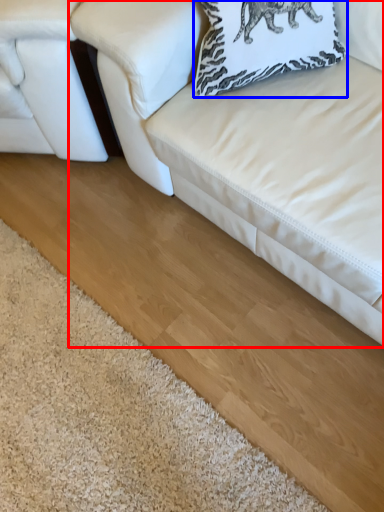
Question: Which of the following is the closest to the observer, studio couch (highlighted by a red box) or pillow (highlighted by a blue box)?

Choices:
 (A) studio couch
 (B) pillow

Answer: (A)